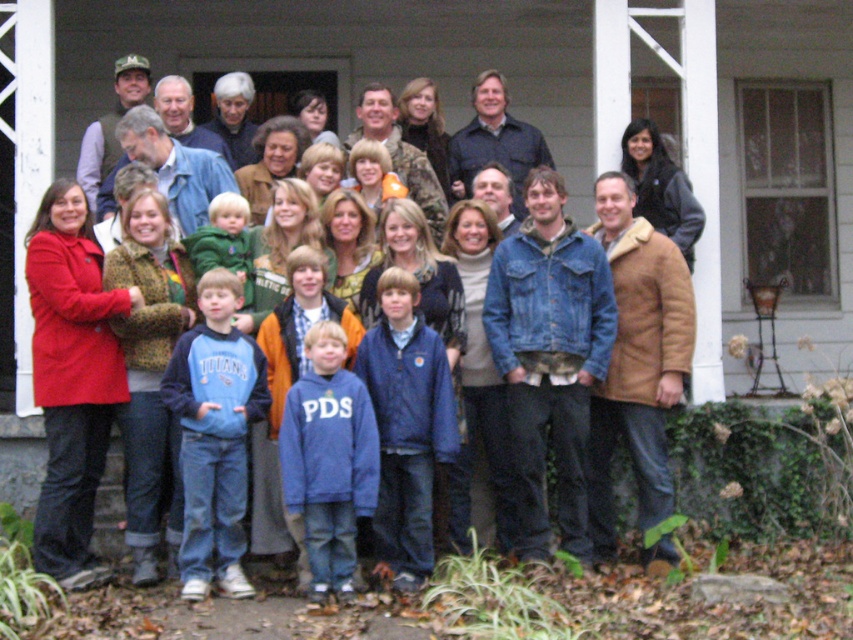
You are organizing a photo shoot and need to ensure that the tan suede coat at lower right and the navy blue fleece at center are visible in the final image. Based on their positions, which clothing item is closer to the right edge of the photo?

The tan suede coat at lower right is positioned on the right side of the navy blue fleece at center, so it is closer to the right edge of the photo.

You are standing at the point closest to the screen door on the porch. There are two points marked in the image, one at coordinates point (379, 481) and another at point (329, 388). If you want to move towards the point that is further away from you, which coordinate should you head towards?

You should head towards point (379, 481) because it is behind point (329, 388), meaning it is farther away from your current position at the screen door.

You are standing on the residential porch with white columns and a screen door window. You notice the navy blue fleece at center. Can you determine its exact location coordinates in the scene?

The navy blue fleece at center is located at point (405, 426).